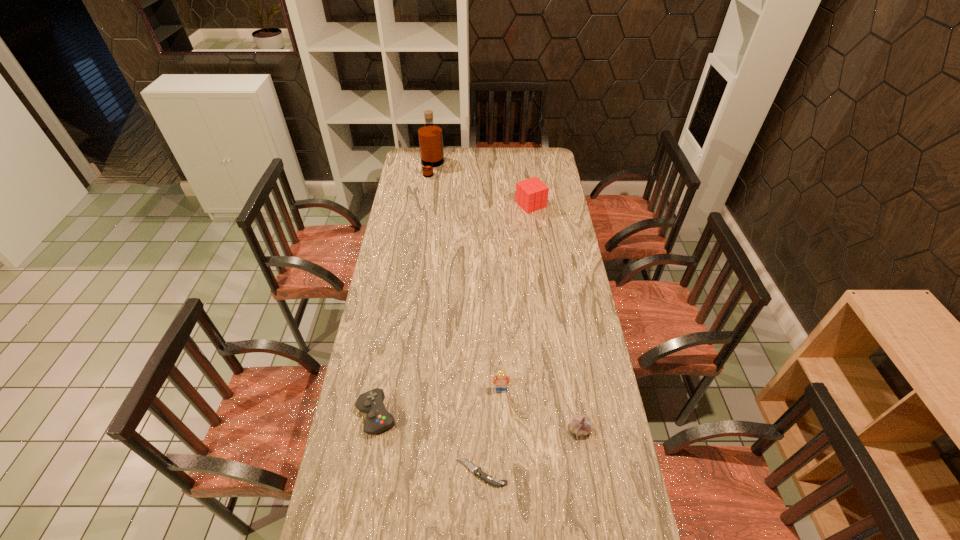
Identify the location of vacant position located 0.260m on the front-facing side of the fourth nearest object. Image resolution: width=960 pixels, height=540 pixels. (504, 470).

Where is `blank space located 0.290m on the back of the garlic`? blank space located 0.290m on the back of the garlic is located at coordinates (567, 346).

You are a GUI agent. You are given a task and a screenshot of the screen. Output one action in this format:
    pyautogui.click(x=<x>, y=<y>)
    Task: Click on the vacant point located on the back of the fifth tallest object
    
    Given the screenshot: What is the action you would take?
    pyautogui.click(x=384, y=374)

Find the location of `free spot located on the right of the shortest object`. free spot located on the right of the shortest object is located at coordinates (603, 472).

Identify the location of object that is at the far edge. The image size is (960, 540). (430, 135).

This screenshot has height=540, width=960. I want to click on liquor present at the left edge, so click(430, 135).

Where is `control that is at the left edge`? Image resolution: width=960 pixels, height=540 pixels. control that is at the left edge is located at coordinates (378, 419).

Find the location of `cube that is at the right edge`. cube that is at the right edge is located at coordinates (531, 194).

This screenshot has height=540, width=960. I want to click on garlic at the right edge, so click(x=581, y=425).

This screenshot has width=960, height=540. Find the location of `object at the far left corner`. object at the far left corner is located at coordinates (430, 135).